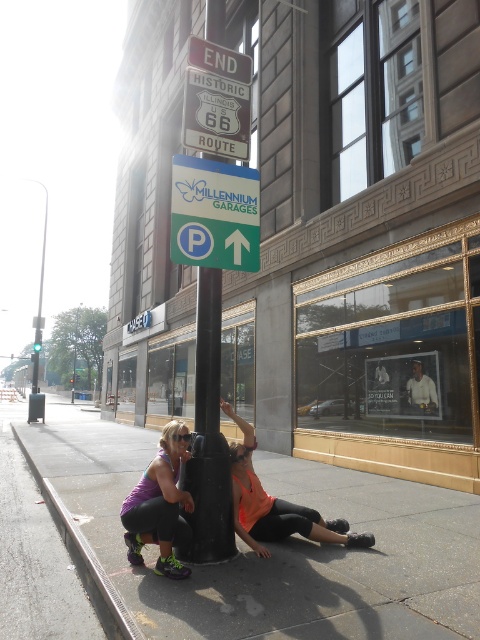
Question: Among these objects, which one is nearest to the camera?

Choices:
 (A) metallic pole at left
 (B) gray concrete sidewalk at lower center
 (C) purple fabric tank top at lower left

Answer: (B)

Question: Based on their relative distances, which object is farther from the gray concrete curb at lower left?

Choices:
 (A) metallic silver sign at center
 (B) purple fabric tank top at lower left
 (C) gray concrete sidewalk at lower center

Answer: (A)

Question: Is purple fabric tank top at lower left below metallic pole at left?

Choices:
 (A) yes
 (B) no

Answer: (A)

Question: From the image, what is the correct spatial relationship of neon orange fabric at center in relation to metallic pole at left?

Choices:
 (A) below
 (B) above

Answer: (A)

Question: Which point is farther to the camera?

Choices:
 (A) gray concrete sidewalk at lower center
 (B) purple fabric tank top at lower left
 (C) neon orange fabric at center

Answer: (C)

Question: From the image, what is the correct spatial relationship of purple fabric tank top at lower left in relation to metallic pole at left?

Choices:
 (A) right
 (B) left

Answer: (A)